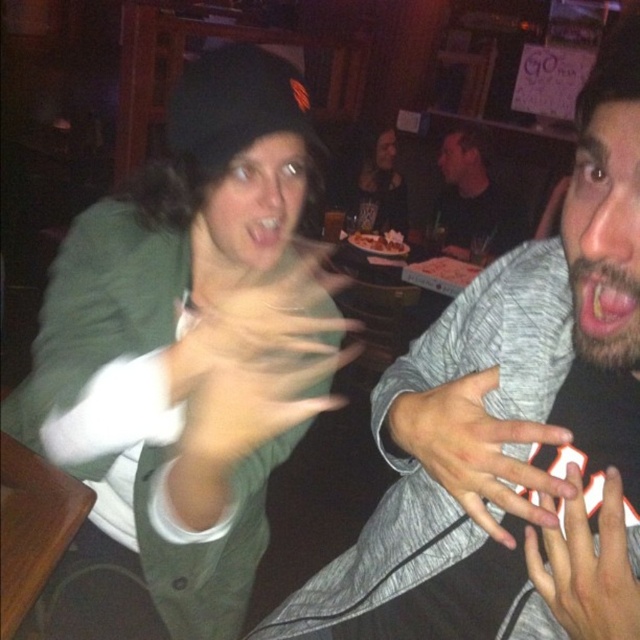
Question: Does green matte jacket at upper left have a lesser width compared to pink glossy lips at center?

Choices:
 (A) no
 (B) yes

Answer: (A)

Question: Considering the real-world distances, which object is farthest from the pink flesh at center?

Choices:
 (A) gray fabric shirt at center
 (B) green matte jacket at upper left
 (C) pink glossy lips at center
 (D) white matte hand at center

Answer: (B)

Question: Which is nearer to the gray fabric shirt at center?

Choices:
 (A) white matte hand at center
 (B) smooth skin hand at center
 (C) pink glossy lips at center
 (D) green matte jacket at upper left

Answer: (A)

Question: Is smooth skin hand at center behind black matte shirt at upper center?

Choices:
 (A) yes
 (B) no

Answer: (B)

Question: Which object is closer to the camera taking this photo?

Choices:
 (A) black matte shirt at upper center
 (B) smooth gray hand at center

Answer: (B)

Question: Is smooth skin hand at center above pink glossy lips at center?

Choices:
 (A) yes
 (B) no

Answer: (B)